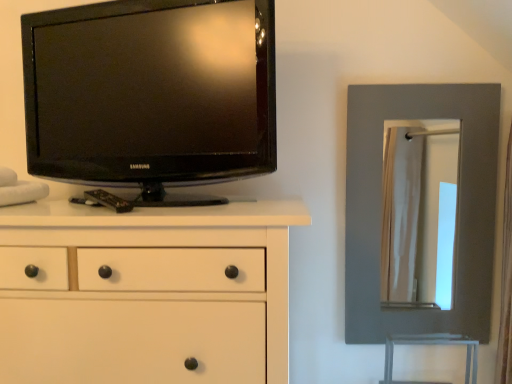
Describe the element at coordinates (151, 92) in the screenshot. I see `black glossy tv at upper left` at that location.

In order to click on white matte chest of drawers at left in this screenshot , I will do `click(145, 293)`.

Is white matte chest of drawers at left with black glossy tv at upper left?

No, white matte chest of drawers at left is not next to black glossy tv at upper left.

Is white matte chest of drawers at left aimed at black glossy tv at upper left?

No.

Is white matte chest of drawers at left taller than black glossy tv at upper left?

Yes, white matte chest of drawers at left is taller than black glossy tv at upper left.

Which is more to the left, white matte chest of drawers at left or black glossy tv at upper left?

white matte chest of drawers at left is more to the left.

Is matte gray mirror at right in front of black glossy tv at upper left?

No.

Is matte gray mirror at right placed right next to black glossy tv at upper left?

They are not placed beside each other.

Considering the points (349, 162) and (168, 143), which point is in front, point (349, 162) or point (168, 143)?

Point (168, 143)

Between matte gray mirror at right and white matte chest of drawers at left, which one appears on the right side from the viewer's perspective?

matte gray mirror at right.

Are matte gray mirror at right and white matte chest of drawers at left located far from each other?

matte gray mirror at right is near white matte chest of drawers at left, not far away.

Would you say matte gray mirror at right is inside or outside white matte chest of drawers at left?

matte gray mirror at right is located beyond the bounds of white matte chest of drawers at left.

From the image's perspective, which one is positioned higher, matte gray mirror at right or white matte chest of drawers at left?

matte gray mirror at right is shown above in the image.

Consider the image. Considering the relative sizes of black glossy tv at upper left and white matte chest of drawers at left in the image provided, is black glossy tv at upper left shorter than white matte chest of drawers at left?

Indeed, black glossy tv at upper left has a lesser height compared to white matte chest of drawers at left.

Which object is further away from the camera, black glossy tv at upper left or white matte chest of drawers at left?

black glossy tv at upper left is further from the camera.

Between black glossy tv at upper left and white matte chest of drawers at left, which one appears on the left side from the viewer's perspective?

From the viewer's perspective, white matte chest of drawers at left appears more on the left side.

Is black glossy tv at upper left next to white matte chest of drawers at left and touching it?

black glossy tv at upper left and white matte chest of drawers at left are clearly separated.

Is black glossy tv at upper left at the left side of matte gray mirror at right?

Indeed, black glossy tv at upper left is positioned on the left side of matte gray mirror at right.

Is black glossy tv at upper left not near matte gray mirror at right?

That's not correct — black glossy tv at upper left is a little close to matte gray mirror at right.

Is point (237, 18) closer to viewer compared to point (476, 118)?

Yes.

Is matte gray mirror at right inside black glossy tv at upper left?

No, matte gray mirror at right is located outside of black glossy tv at upper left.

Relative to matte gray mirror at right, is white matte chest of drawers at left in front or behind?

Clearly, white matte chest of drawers at left is in front of matte gray mirror at right.

Between white matte chest of drawers at left and matte gray mirror at right, which one has larger width?

Wider between the two is white matte chest of drawers at left.

From the picture: From a real-world perspective, which object rests below the other?

white matte chest of drawers at left, from a real-world perspective.

Image resolution: width=512 pixels, height=384 pixels. What are the coordinates of `the chest of drawers that is below the black glossy tv at upper left (from the image's perspective)` in the screenshot? It's located at (145, 293).

In order to click on television lying in front of the matte gray mirror at right in this screenshot , I will do `click(151, 92)`.

Based on their spatial positions, is matte gray mirror at right or white matte chest of drawers at left closer to black glossy tv at upper left?

white matte chest of drawers at left lies closer to black glossy tv at upper left than the other object.

Based on their spatial positions, is white matte chest of drawers at left or black glossy tv at upper left closer to matte gray mirror at right?

black glossy tv at upper left is positioned closer to the anchor matte gray mirror at right.

From the image, which object appears to be farther from white matte chest of drawers at left, matte gray mirror at right or black glossy tv at upper left?

Among the two, matte gray mirror at right is located further to white matte chest of drawers at left.

Estimate the real-world distances between objects in this image. Which object is further from white matte chest of drawers at left, black glossy tv at upper left or matte gray mirror at right?

matte gray mirror at right is further to white matte chest of drawers at left.

When comparing their distances from matte gray mirror at right, does black glossy tv at upper left or white matte chest of drawers at left seem further?

white matte chest of drawers at left is further to matte gray mirror at right.

Which object lies nearer to the anchor point black glossy tv at upper left, white matte chest of drawers at left or matte gray mirror at right?

white matte chest of drawers at left is closer to black glossy tv at upper left.

The width and height of the screenshot is (512, 384). I want to click on television situated between white matte chest of drawers at left and matte gray mirror at right from left to right, so click(151, 92).